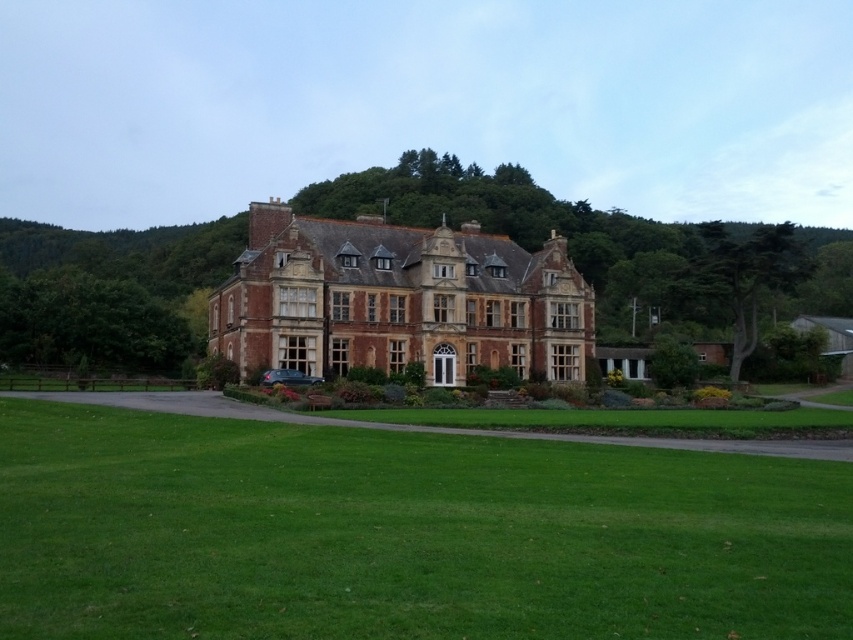
Measure the distance between green grass at center and brown brick mansion at center.

green grass at center and brown brick mansion at center are 32.93 meters apart from each other.

Can you confirm if green grass at center is wider than brown brick mansion at center?

Indeed, green grass at center has a greater width compared to brown brick mansion at center.

Is point (631, 477) positioned before point (380, 289)?

Yes, it is in front of point (380, 289).

Where is `green grass at center`? green grass at center is located at coordinates (403, 534).